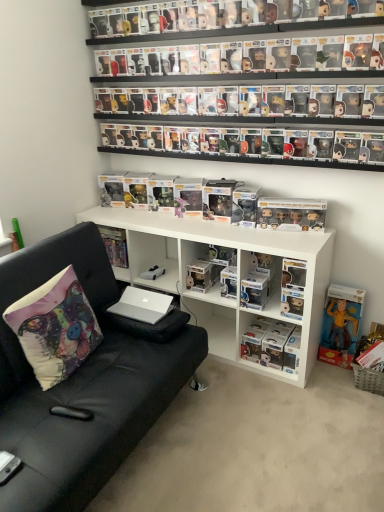
Question: From the image's perspective, is black plastic remote control at lower left located above or below satin gold figurines at center, which appears as the 3th toy when viewed from the top?

Choices:
 (A) above
 (B) below

Answer: (B)

Question: Which is correct: black plastic remote control at lower left is inside satin gold figurines at center, the second toy from the right, or outside of it?

Choices:
 (A) outside
 (B) inside

Answer: (A)

Question: Which object is the farthest from the matte fabric pillow at left?

Choices:
 (A) clear plastic figure at center, marked as the second book in a right-to-left arrangement
 (B) white matte shelf at center
 (C) black plastic remote control at lower left
 (D) matte black figurine at upper center, marked as the fourth toy in a bottom-to-top arrangement
 (E) white matte car at center, acting as the first toy starting from the bottom

Answer: (D)

Question: Estimate the real-world distances between objects in this image. Which object is farther from the satin gold figurines at center, which appears as the 3th toy when viewed from the top?

Choices:
 (A) yellow fabric figurine at lower right, the third book positioned from the left
 (B) white matte car at center, placed as the second toy when sorted from left to right
 (C) hardcover book at center, the third book viewed from the right
 (D) matte fabric pillow at left
 (E) clear plastic figure at center, the 2th book viewed from the left

Answer: (D)